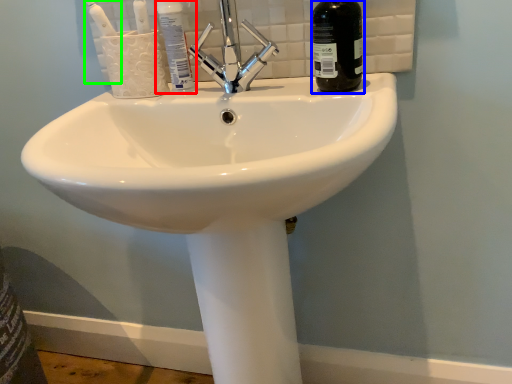
Question: Which object is positioned closest to mouthwash (highlighted by a red box)? Select from bottle (highlighted by a blue box) and toothbrush (highlighted by a green box).

Choices:
 (A) bottle
 (B) toothbrush

Answer: (B)